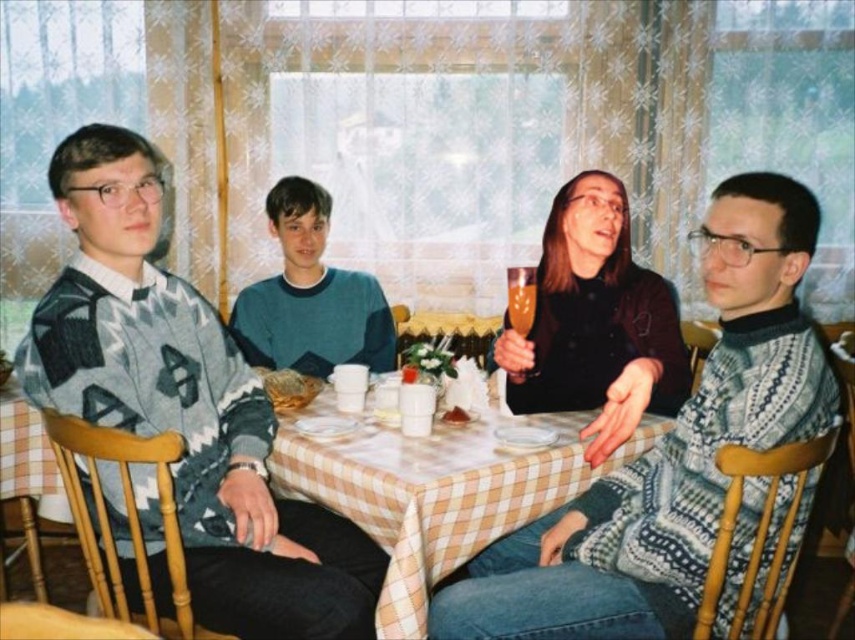
Question: Can you confirm if knitted sweater at left is wider than checkered fabric table at center?

Choices:
 (A) yes
 (B) no

Answer: (B)

Question: Can you confirm if knitted sweater at left is wider than translucent glass at center?

Choices:
 (A) yes
 (B) no

Answer: (A)

Question: Does checkered fabric table at center appear on the right side of translucent glass at center?

Choices:
 (A) no
 (B) yes

Answer: (B)

Question: Estimate the real-world distances between objects in this image. Which object is closer to the translucent glass at center?

Choices:
 (A) teal sweater at center
 (B) translucent glass at upper center
 (C) knitted sweater at center
 (D) knitted sweater at left

Answer: (B)

Question: Among these objects, which one is farthest from the camera?

Choices:
 (A) knitted sweater at center
 (B) checkered fabric table at center
 (C) translucent glass at upper center

Answer: (C)

Question: Which point is closer to the camera?

Choices:
 (A) (758, 376)
 (B) (520, 472)

Answer: (A)